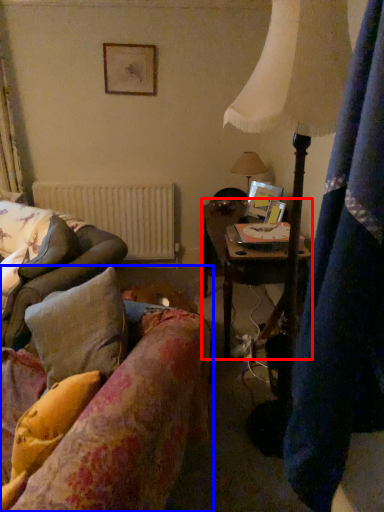
Question: Which object is closer to the camera taking this photo, table (highlighted by a red box) or studio couch (highlighted by a blue box)?

Choices:
 (A) table
 (B) studio couch

Answer: (B)